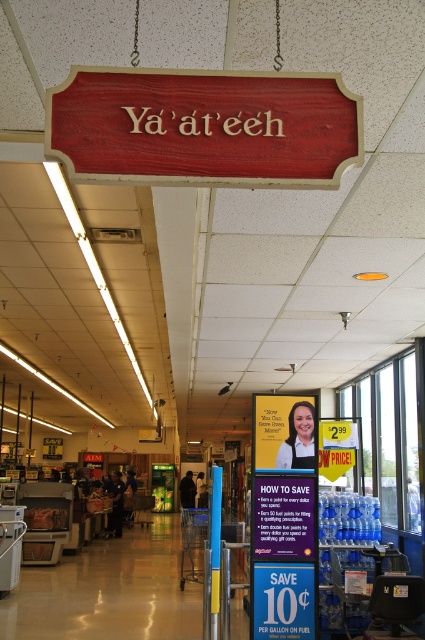
You are standing in the Yaathee section of the store and want to reach a product located at point (275, 422). There is an obstacle at point (258, 518). Can you walk around the obstacle to reach your destination?

Point (258, 518) is closer to the viewer than point (275, 422), so the obstacle at point (258, 518) is in front of the destination. You can walk around it to reach the destination.